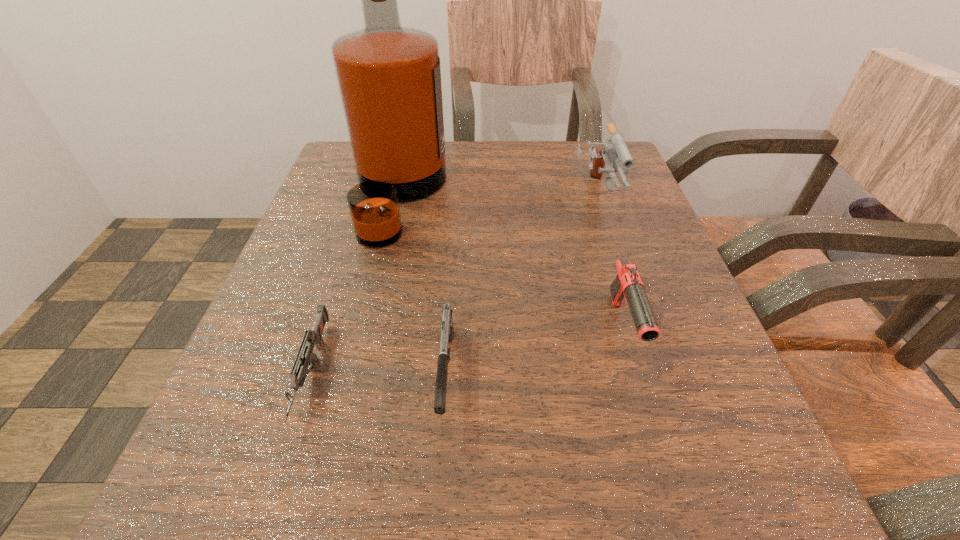
Identify the location of vacant space located 0.050m at the aiming end of the third tallest object. The height and width of the screenshot is (540, 960). (646, 403).

I want to click on blank area located 0.070m at the muzzle end of the fourth tallest object, so click(x=439, y=495).

In order to click on free space located aimed along the barrel of the leftmost gun in this screenshot , I will do `click(270, 505)`.

This screenshot has width=960, height=540. What are the coordinates of `liquor that is at the far edge` in the screenshot? It's located at (389, 78).

At what (x,y) coordinates should I click in order to perform the action: click on gun present at the far edge. Please return your answer as a coordinate pair (x, y). The height and width of the screenshot is (540, 960). Looking at the image, I should click on (614, 150).

You are a GUI agent. You are given a task and a screenshot of the screen. Output one action in this format:
    pyautogui.click(x=<x>, y=<y>)
    Task: Click on the liquor positioned at the left edge
    The image size is (960, 540).
    Given the screenshot: What is the action you would take?
    pyautogui.click(x=389, y=78)

What are the coordinates of `gun that is at the left edge` in the screenshot? It's located at (313, 337).

At what (x,y) coordinates should I click in order to perform the action: click on object located at the far left corner. Please return your answer as a coordinate pair (x, y). Looking at the image, I should click on (389, 78).

The width and height of the screenshot is (960, 540). In order to click on object present at the far right corner in this screenshot , I will do `click(614, 150)`.

At what (x,y) coordinates should I click in order to perform the action: click on vacant area at the far edge. Please return your answer as a coordinate pair (x, y). The width and height of the screenshot is (960, 540). Looking at the image, I should click on (559, 184).